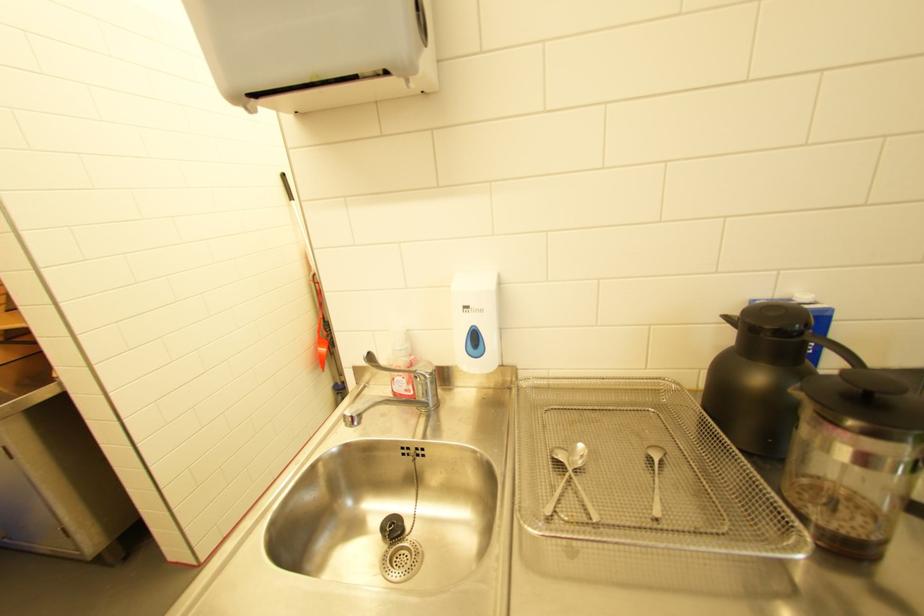
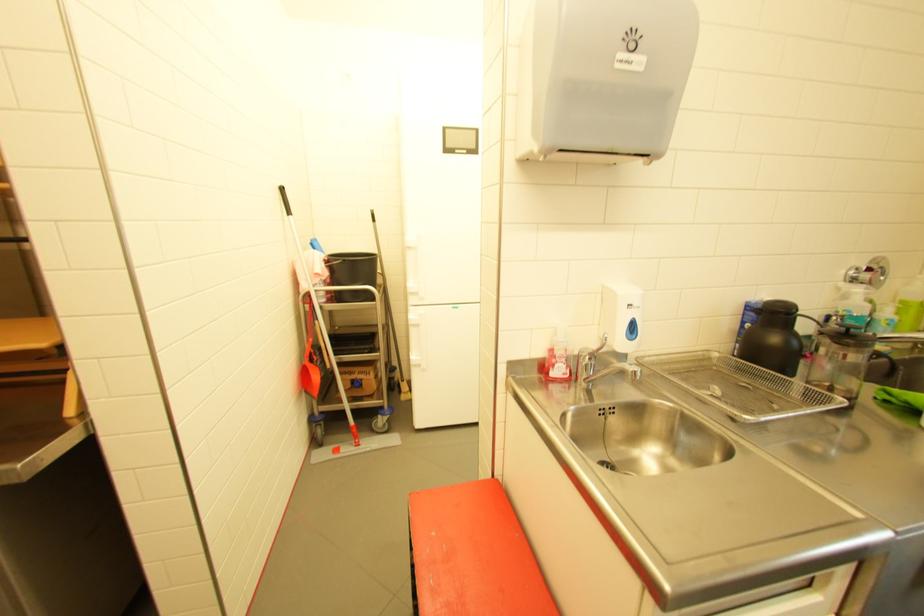
Find the pixel in the second image that matches [766,379] in the first image.

(782, 339)